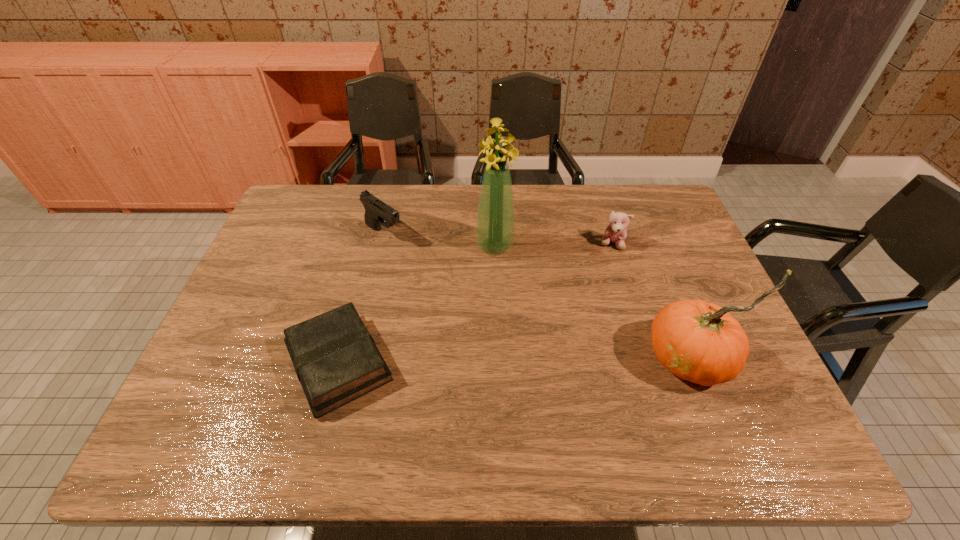
I want to click on object at the right edge, so click(x=701, y=342).

Locate an element on the screen. This screenshot has width=960, height=540. object present at the near right corner is located at coordinates (701, 342).

You are a GUI agent. You are given a task and a screenshot of the screen. Output one action in this format:
    pyautogui.click(x=<x>, y=<y>)
    Task: Click on the vacant space at the far edge
    
    Given the screenshot: What is the action you would take?
    pos(548,205)

In the image, there is a desktop. At what (x,y) coordinates should I click in order to perform the action: click on free space at the near edge. Please return your answer as a coordinate pair (x, y). This screenshot has height=540, width=960. Looking at the image, I should click on (276, 398).

Where is `vacant area at the left edge of the desktop`? vacant area at the left edge of the desktop is located at coordinates (281, 279).

At what (x,y) coordinates should I click in order to perform the action: click on vacant region at the right edge of the desktop. Please return your answer as a coordinate pair (x, y). Looking at the image, I should click on (686, 247).

What are the coordinates of `vacant region at the far left corner of the desktop` in the screenshot? It's located at (276, 222).

In the image, there is a desktop. Where is `free space at the far right corner`? free space at the far right corner is located at coordinates (658, 213).

Find the location of `vacant space that's between the shortest object and the pistol`. vacant space that's between the shortest object and the pistol is located at coordinates (361, 298).

The height and width of the screenshot is (540, 960). Find the location of `free space between the shortest object and the teddy bear`. free space between the shortest object and the teddy bear is located at coordinates (475, 303).